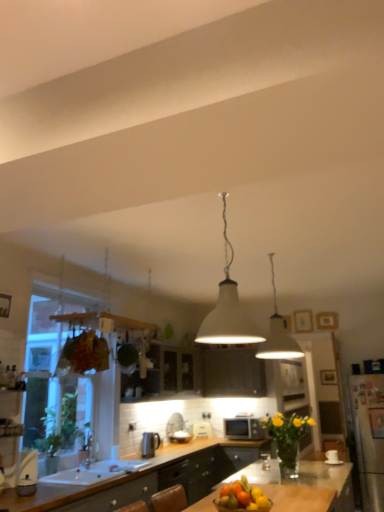
This screenshot has width=384, height=512. What do you see at coordinates (96, 472) in the screenshot?
I see `white glossy sink at lower left` at bounding box center [96, 472].

How much space does white glossy toaster at center, which appears as the 2th appliance when viewed from the back, occupy horizontally?

white glossy toaster at center, which appears as the 2th appliance when viewed from the back, is 4.53 inches wide.

Find the location of a particular element. white glossy toaster at center, which is the 1th appliance in front-to-back order is located at coordinates (177, 429).

Image resolution: width=384 pixels, height=512 pixels. In order to click on white matte lampshade at center, the second lamp in the right-to-left sequence in this screenshot , I will do `click(228, 307)`.

Measure the distance between point (293, 358) and camera.

The depth of point (293, 358) is 4.97 meters.

This screenshot has height=512, width=384. I want to click on white glossy cabinet at center, so click(167, 372).

In terms of height, does transparent glass window at left look taller or shorter compared to white glossy sink at lower left?

In the image, transparent glass window at left appears to be taller than white glossy sink at lower left.

Can you confirm if transparent glass window at left is thinner than white glossy sink at lower left?

Correct, the width of transparent glass window at left is less than that of white glossy sink at lower left.

Is transparent glass window at left turned away from white glossy sink at lower left?

transparent glass window at left is not turned away from white glossy sink at lower left.

From a real-world perspective, relative to white plastic toaster at center, the second appliance viewed from the front, is white glossy toaster at center, placed as the 2th appliance when sorted from right to left, vertically above or below?

white glossy toaster at center, placed as the 2th appliance when sorted from right to left, is above white plastic toaster at center, the second appliance viewed from the front.

Considering the relative sizes of white glossy toaster at center, which is the 1th appliance in front-to-back order, and white plastic toaster at center, which ranks as the 2th appliance in left-to-right order, in the image provided, is white glossy toaster at center, which is the 1th appliance in front-to-back order, taller than white plastic toaster at center, which ranks as the 2th appliance in left-to-right order,?

Correct, white glossy toaster at center, which is the 1th appliance in front-to-back order, is much taller as white plastic toaster at center, which ranks as the 2th appliance in left-to-right order.

Which object is wider, white glossy toaster at center, which appears as the 2th appliance when viewed from the back, or white plastic toaster at center, the second appliance viewed from the front?

white plastic toaster at center, the second appliance viewed from the front, is wider.

From a real-world perspective, which is physically above, transparent glass window at left or white matte lampshade at center, the second lamp when ordered from back to front?

white matte lampshade at center, the second lamp when ordered from back to front, from a real-world perspective.

Considering the positions of points (40, 331) and (238, 333), is point (40, 331) closer to camera compared to point (238, 333)?

No, (40, 331) is further to viewer.

Between transparent glass window at left and white matte lampshade at center, the second lamp when ordered from back to front, which one has smaller width?

Thinner between the two is transparent glass window at left.

Is transparent glass window at left in front of or behind white matte lampshade at center, the second lamp when ordered from back to front, in the image?

Clearly, transparent glass window at left is behind white matte lampshade at center, the second lamp when ordered from back to front.

Consider the image. Is white plastic toaster at center, the second appliance viewed from the front, next to transparent glass window at left and touching it?

No.

Locate an element on the screen. window on the left side of white plastic toaster at center, marked as the first appliance in a right-to-left arrangement is located at coordinates (52, 323).

Can you confirm if white plastic toaster at center, which is the first appliance from back to front, is taller than transparent glass window at left?

No, white plastic toaster at center, which is the first appliance from back to front, is not taller than transparent glass window at left.

Is white plastic toaster at center, which is the first appliance from back to front, surrounding transparent glass window at left?

No, transparent glass window at left is not surrounded by white plastic toaster at center, which is the first appliance from back to front.

Is white glossy cabinet at center smaller than white glossy sink at lower left?

Actually, white glossy cabinet at center might be larger than white glossy sink at lower left.

Does white glossy cabinet at center have a lesser width compared to white glossy sink at lower left?

Correct, the width of white glossy cabinet at center is less than that of white glossy sink at lower left.

From the image's perspective, which object appears higher, white glossy cabinet at center or white glossy sink at lower left?

From the image's view, white glossy cabinet at center is above.

From a real-world perspective, is white glossy cabinet at center positioned under white glossy sink at lower left based on gravity?

No, from a real-world perspective, white glossy cabinet at center is not below white glossy sink at lower left.

In the scene shown: From the image's perspective, which object appears higher, white glossy cabinet at center or white plastic toaster at center, the second appliance viewed from the front?

white glossy cabinet at center appears higher in the image.

From a real-world perspective, is white glossy cabinet at center physically located above or below white plastic toaster at center, which ranks as the 2th appliance in left-to-right order?

white glossy cabinet at center is above white plastic toaster at center, which ranks as the 2th appliance in left-to-right order.

Which of these two, white glossy cabinet at center or white plastic toaster at center, which is the first appliance from back to front, is wider?

With larger width is white glossy cabinet at center.

Which is behind, point (196, 388) or point (203, 421)?

The point (196, 388) is farther.

Consider the image. Looking at the image, does matte black microwave at center seem bigger or smaller compared to white plastic toaster at center, marked as the first appliance in a right-to-left arrangement?

matte black microwave at center is bigger than white plastic toaster at center, marked as the first appliance in a right-to-left arrangement.

Are matte black microwave at center and white plastic toaster at center, the second appliance viewed from the front, beside each other?

matte black microwave at center and white plastic toaster at center, the second appliance viewed from the front, are not in contact.

Locate an element on the screen. This screenshot has width=384, height=512. microwave oven above the white plastic toaster at center, which is the first appliance from back to front (from a real-world perspective) is located at coordinates (243, 428).

Where is `window above the white glossy sink at lower left (from a real-world perspective)`? This screenshot has width=384, height=512. window above the white glossy sink at lower left (from a real-world perspective) is located at coordinates (52, 323).

Locate an element on the screen. The height and width of the screenshot is (512, 384). appliance located in front of the white plastic toaster at center, which ranks as the 2th appliance in left-to-right order is located at coordinates (177, 429).

From the picture: When comparing their distances from white glossy cabinet at center, does white plastic toaster at center, marked as the first appliance in a right-to-left arrangement, or white glossy sink at lower left seem closer?

Among the two, white plastic toaster at center, marked as the first appliance in a right-to-left arrangement, is located nearer to white glossy cabinet at center.

Considering their positions, is white matte lampshade at center, marked as the 1th lamp in a back-to-front arrangement, positioned closer to transparent glass window at left than white plastic toaster at center, which ranks as the 2th appliance in left-to-right order?

white matte lampshade at center, marked as the 1th lamp in a back-to-front arrangement.

Looking at the image, which one is located further to transparent glass window at left, white matte lampshade at center, which is counted as the first lamp, starting from the front, or white matte lampshade at center, marked as the 1th lamp in a back-to-front arrangement?

white matte lampshade at center, marked as the 1th lamp in a back-to-front arrangement.

When comparing their distances from white matte lampshade at center, arranged as the second lamp when viewed from the left, does white glossy cabinet at center or white glossy toaster at center, which appears as the 2th appliance when viewed from the back, seem further?

white glossy toaster at center, which appears as the 2th appliance when viewed from the back, lies further to white matte lampshade at center, arranged as the second lamp when viewed from the left, than the other object.

Based on their spatial positions, is matte black microwave at center or white matte lampshade at center, which appears as the first lamp when viewed from the left, closer to white matte lampshade at center, the second lamp from the front?

white matte lampshade at center, which appears as the first lamp when viewed from the left.

Estimate the real-world distances between objects in this image. Which object is further from white glossy toaster at center, placed as the 2th appliance when sorted from right to left, matte black microwave at center or white plastic toaster at center, marked as the first appliance in a right-to-left arrangement?

matte black microwave at center lies further to white glossy toaster at center, placed as the 2th appliance when sorted from right to left, than the other object.

Which object lies further to the anchor point white glossy sink at lower left, white plastic toaster at center, the second appliance viewed from the front, or matte black microwave at center?

matte black microwave at center is positioned further to the anchor white glossy sink at lower left.

Which object lies nearer to the anchor point white glossy toaster at center, which appears as the 2th appliance when viewed from the back, white matte lampshade at center, the second lamp from the front, or white matte lampshade at center, the second lamp in the right-to-left sequence?

Based on the image, white matte lampshade at center, the second lamp from the front, appears to be nearer to white glossy toaster at center, which appears as the 2th appliance when viewed from the back.

Where is `appliance between transparent glass window at left and white plastic toaster at center, which is the first appliance from back to front, from front to back`? Image resolution: width=384 pixels, height=512 pixels. appliance between transparent glass window at left and white plastic toaster at center, which is the first appliance from back to front, from front to back is located at coordinates (177, 429).

Where is `microwave oven between white glossy sink at lower left and white plastic toaster at center, which is the first appliance from back to front, in the front-back direction`? microwave oven between white glossy sink at lower left and white plastic toaster at center, which is the first appliance from back to front, in the front-back direction is located at coordinates (243, 428).

Where is `sink between white matte lampshade at center, the second lamp in the right-to-left sequence, and white glossy toaster at center, the 1th appliance viewed from the left, from front to back`? The image size is (384, 512). sink between white matte lampshade at center, the second lamp in the right-to-left sequence, and white glossy toaster at center, the 1th appliance viewed from the left, from front to back is located at coordinates (96, 472).

Where is `lamp between white matte lampshade at center, the second lamp in the right-to-left sequence, and white glossy sink at lower left in the up-down direction`? The image size is (384, 512). lamp between white matte lampshade at center, the second lamp in the right-to-left sequence, and white glossy sink at lower left in the up-down direction is located at coordinates (278, 334).